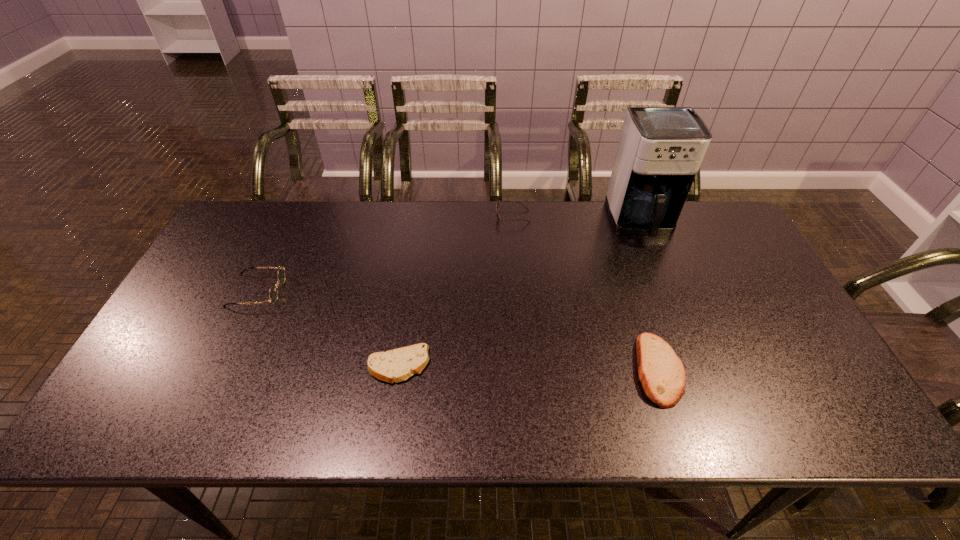
Where is `free space located on the front-facing side of the sunglasses`? This screenshot has height=540, width=960. free space located on the front-facing side of the sunglasses is located at coordinates (379, 217).

Where is `free space located on the front-facing side of the sunglasses`? This screenshot has width=960, height=540. free space located on the front-facing side of the sunglasses is located at coordinates (478, 217).

In order to click on vacant area located 0.130m on the left of the right pita bread in this screenshot , I will do `click(581, 369)`.

Where is `vacant space located 0.230m on the right of the second object from left to right`? This screenshot has width=960, height=540. vacant space located 0.230m on the right of the second object from left to right is located at coordinates (524, 366).

Where is `coffee maker present at the far edge`? The height and width of the screenshot is (540, 960). coffee maker present at the far edge is located at coordinates (660, 150).

This screenshot has height=540, width=960. Find the location of `sunglasses that is at the far edge`. sunglasses that is at the far edge is located at coordinates (497, 205).

Where is `object that is at the near edge`? The width and height of the screenshot is (960, 540). object that is at the near edge is located at coordinates coord(662,374).

The height and width of the screenshot is (540, 960). I want to click on object at the left edge, so click(x=273, y=292).

The width and height of the screenshot is (960, 540). In the image, there is a desktop. What are the coordinates of `vacant space at the far edge` in the screenshot? It's located at (582, 204).

In the image, there is a desktop. At what (x,y) coordinates should I click in order to perform the action: click on free region at the near edge. Please return your answer as a coordinate pair (x, y). The height and width of the screenshot is (540, 960). Looking at the image, I should click on point(768,430).